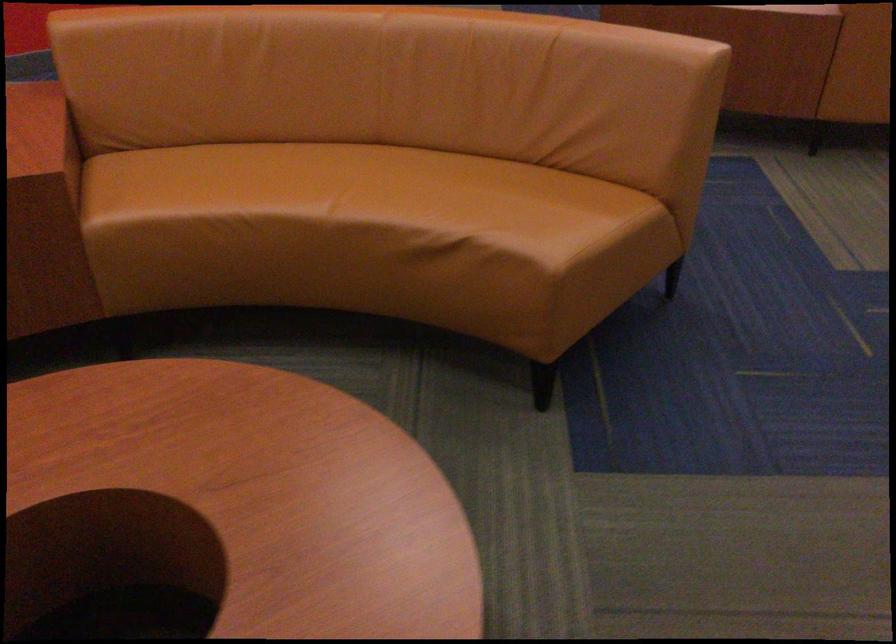
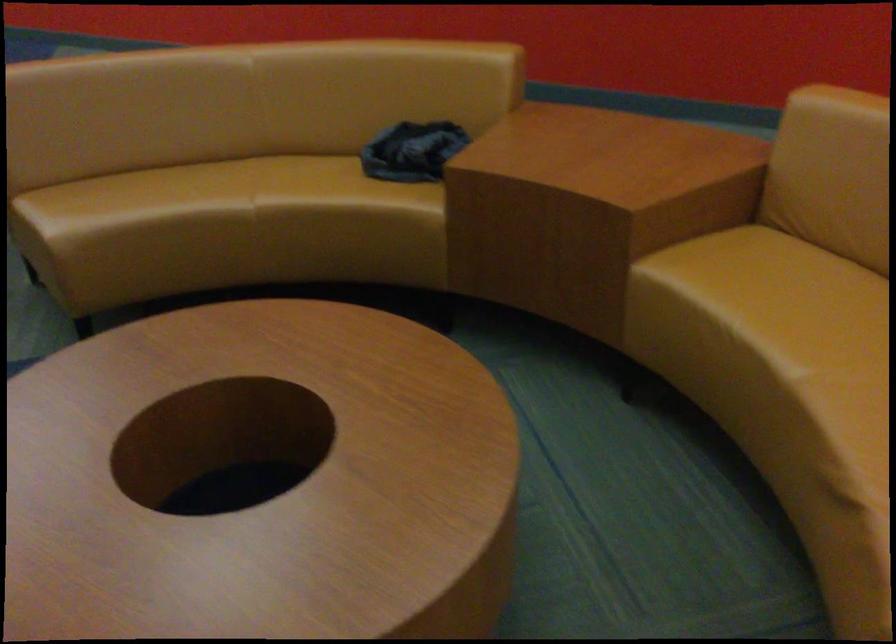
Where in the second image is the point corresponding to the point at 262,182 from the first image?

(814, 308)